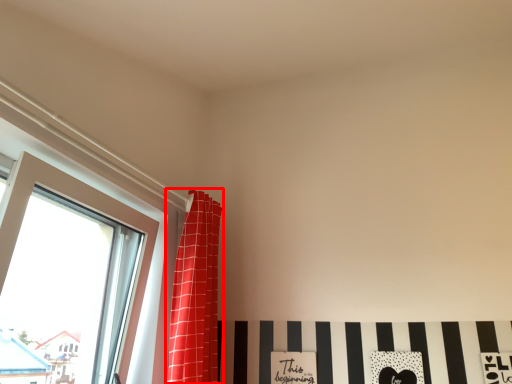
Question: In this image, where is curtain (annotated by the red box) located relative to window?

Choices:
 (A) right
 (B) left

Answer: (A)